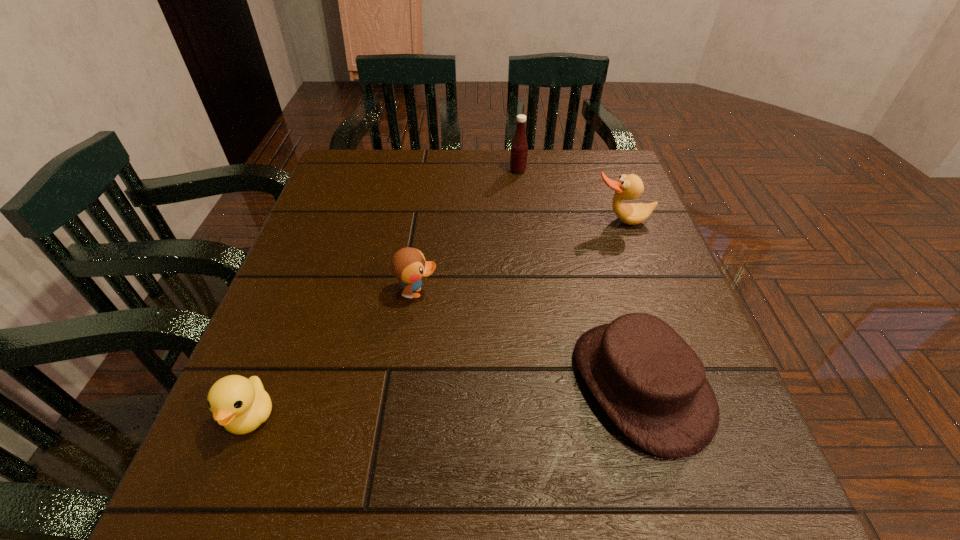
Find the location of a particular element. vacant space positioned 0.290m on the beak of the second farthest object is located at coordinates (661, 329).

Identify the location of blank space located on the front-facing side of the second duck from right to left. pyautogui.click(x=544, y=293).

Identify the location of free region located 0.070m on the face of the nearest duck. The image size is (960, 540). (219, 497).

Locate an element on the screen. The height and width of the screenshot is (540, 960). free space located on the left of the hat is located at coordinates tap(468, 383).

Find the location of `object at the far edge`. object at the far edge is located at coordinates (519, 148).

Where is `object positioned at the left edge`? object positioned at the left edge is located at coordinates (241, 405).

The width and height of the screenshot is (960, 540). I want to click on duck positioned at the right edge, so click(x=628, y=187).

The image size is (960, 540). In order to click on hat that is at the right edge in this screenshot , I will do `click(652, 385)`.

Where is `free location at the far edge`? This screenshot has width=960, height=540. free location at the far edge is located at coordinates (475, 165).

You are a GUI agent. You are given a task and a screenshot of the screen. Output one action in this format:
    pyautogui.click(x=<x>, y=<y>)
    Task: Click on the vacant space at the near edge of the desktop
    
    Given the screenshot: What is the action you would take?
    pyautogui.click(x=412, y=504)